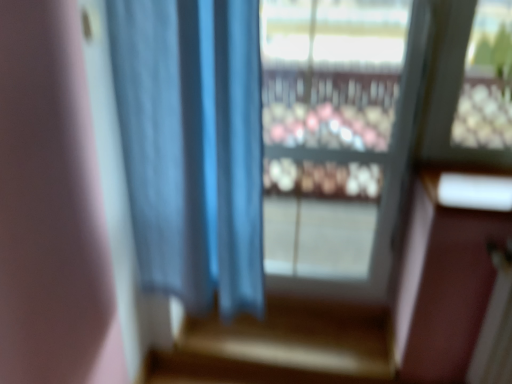
This screenshot has height=384, width=512. I want to click on blue fabric curtain at center, so click(193, 146).

Image resolution: width=512 pixels, height=384 pixels. What do you see at coordinates (193, 146) in the screenshot?
I see `blue fabric curtain at center` at bounding box center [193, 146].

What is the approximate width of blue fabric curtain at center?

The width of blue fabric curtain at center is 4.44 inches.

Measure the distance between point (318, 33) and camera.

Point (318, 33) is 2.83 meters from camera.

What do you see at coordinates (337, 140) in the screenshot? I see `transparent glass window at center` at bounding box center [337, 140].

Where is `transparent glass window at center`? transparent glass window at center is located at coordinates 337,140.

You are a GUI agent. You are given a task and a screenshot of the screen. Output one action in this format:
    pyautogui.click(x=<x>, y=<y>)
    Task: Click on the blue fabric curtain at center
    The height and width of the screenshot is (384, 512).
    Given the screenshot: What is the action you would take?
    pyautogui.click(x=193, y=146)

In the image, is transparent glass window at center on the left side or the right side of blue fabric curtain at center?

Clearly, transparent glass window at center is on the right of blue fabric curtain at center in the image.

Is transparent glass window at center positioned in front of blue fabric curtain at center?

No, transparent glass window at center is further to the viewer.

Is point (404, 105) positioned before point (234, 181)?

No, (404, 105) is further to viewer.

From the image's perspective, which object appears higher, transparent glass window at center or blue fabric curtain at center?

transparent glass window at center, from the image's perspective.

From the picture: From a real-world perspective, is transparent glass window at center below blue fabric curtain at center?

Yes, from a real-world perspective, transparent glass window at center is below blue fabric curtain at center.

Does transparent glass window at center have a greater width compared to blue fabric curtain at center?

No.

Considering the sizes of transparent glass window at center and blue fabric curtain at center in the image, is transparent glass window at center taller or shorter than blue fabric curtain at center?

In the image, transparent glass window at center appears to be taller than blue fabric curtain at center.

Can you confirm if transparent glass window at center is smaller than blue fabric curtain at center?

Yes, transparent glass window at center is smaller than blue fabric curtain at center.

Would you say blue fabric curtain at center is part of transparent glass window at center's contents?

Actually, blue fabric curtain at center is outside transparent glass window at center.

Based on the photo, is transparent glass window at center with blue fabric curtain at center?

No, transparent glass window at center is not making contact with blue fabric curtain at center.

From the picture: Is transparent glass window at center oriented away from blue fabric curtain at center?

No, transparent glass window at center is not facing away from blue fabric curtain at center.

How different are the orientations of transparent glass window at center and blue fabric curtain at center in degrees?

1.66 degrees separate the facing orientations of transparent glass window at center and blue fabric curtain at center.

How far apart are transparent glass window at center and blue fabric curtain at center?

1.08 meters.

The width and height of the screenshot is (512, 384). Find the location of `curtain that is above the transparent glass window at center (from a real-world perspective)`. curtain that is above the transparent glass window at center (from a real-world perspective) is located at coordinates (193, 146).

Between blue fabric curtain at center and transparent glass window at center, which one appears on the right side from the viewer's perspective?

From the viewer's perspective, transparent glass window at center appears more on the right side.

Is blue fabric curtain at center positioned in front of transparent glass window at center?

Yes, it is.

Does point (133, 103) come farther from viewer compared to point (350, 9)?

No, it is in front of (350, 9).

From the image's perspective, is blue fabric curtain at center beneath transparent glass window at center?

Yes, from the image's perspective, blue fabric curtain at center is below transparent glass window at center.

From a real-world perspective, is blue fabric curtain at center physically located above or below transparent glass window at center?

blue fabric curtain at center is above transparent glass window at center.

In terms of width, does blue fabric curtain at center look wider or thinner when compared to transparent glass window at center?

blue fabric curtain at center is wider than transparent glass window at center.

Which of these two, blue fabric curtain at center or transparent glass window at center, stands shorter?

blue fabric curtain at center is shorter.

Is blue fabric curtain at center bigger than transparent glass window at center?

Indeed, blue fabric curtain at center has a larger size compared to transparent glass window at center.

Based on the photo, choose the correct answer: Is blue fabric curtain at center inside transparent glass window at center or outside it?

blue fabric curtain at center cannot be found inside transparent glass window at center.

Are blue fabric curtain at center and transparent glass window at center making contact?

They are not placed beside each other.

Does blue fabric curtain at center turn towards transparent glass window at center?

No, blue fabric curtain at center is not oriented towards transparent glass window at center.

This screenshot has height=384, width=512. In the image, there is a blue fabric curtain at center. What are the coordinates of `window below it (from a real-world perspective)` in the screenshot? It's located at (337, 140).

You are a GUI agent. You are given a task and a screenshot of the screen. Output one action in this format:
    pyautogui.click(x=<x>, y=<y>)
    Task: Click on the window behind the blue fabric curtain at center
    
    Given the screenshot: What is the action you would take?
    pyautogui.click(x=337, y=140)

Locate an element on the screen. curtain below the transparent glass window at center (from the image's perspective) is located at coordinates (193, 146).